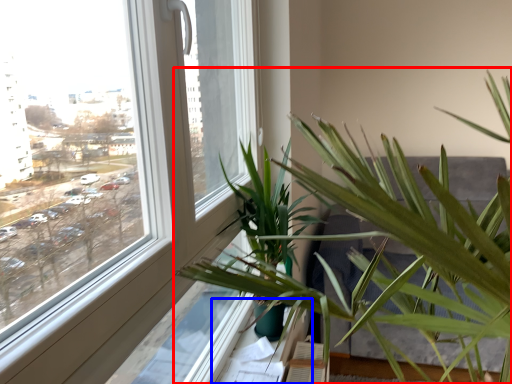
Question: Which object appears closest to the camera in this image, houseplant (highlighted by a red box) or window sill (highlighted by a blue box)?

Choices:
 (A) houseplant
 (B) window sill

Answer: (A)